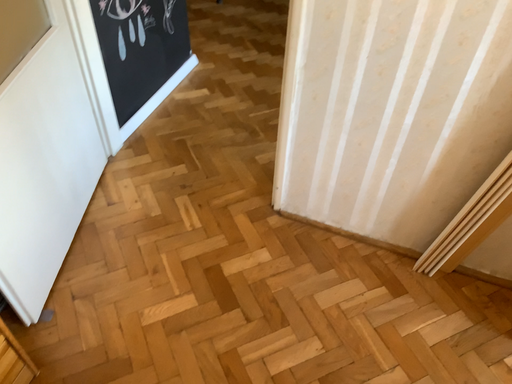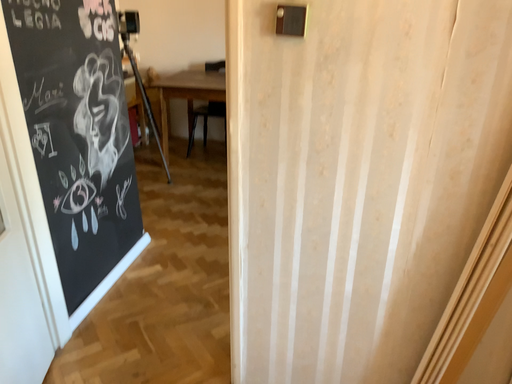
Question: How did the camera likely rotate when shooting the video?

Choices:
 (A) rotated downward
 (B) rotated upward

Answer: (B)